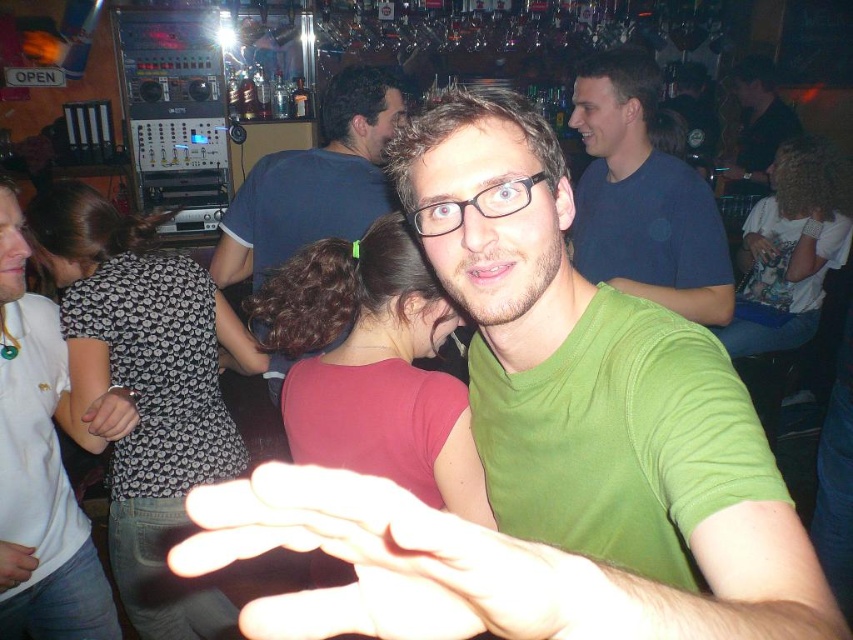
You are a photographer adjusting lighting in the scene. The bright white flesh at center and the light skin hand at center are both in focus. Which object is more likely to be overexposed due to its brightness?

The bright white flesh at center is much taller as light skin hand at center, so the bright white flesh at center is more likely to be overexposed due to its higher brightness.

You are a photographer trying to capture a candid shot of both the white dotted shirt at left and the blue cotton shirt at center. Based on their positions, which one is lower in the frame?

The white dotted shirt at left is below the blue cotton shirt at center, so the white dotted shirt at left is lower in the frame.